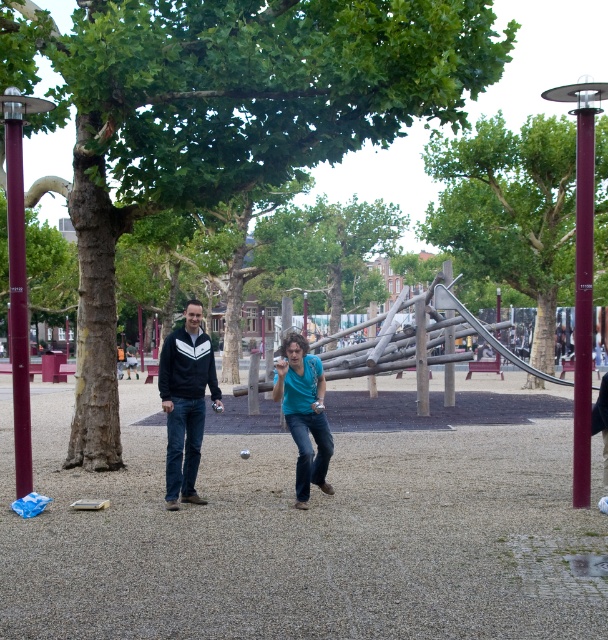
You are a photographer trying to capture a candid shot of the two people in the park. You notice the dark blue jacket at center and the blue denim jeans at center. Which clothing item is covering the other?

The dark blue jacket at center is positioned over the blue denim jeans at center, so the jacket is covering the jeans.

You are a photographer trying to capture a candid shot of the two people in the scene. You notice that the blue denim jeans at center and the matte black jacket at center are close to each other. Which of these two items would appear narrower in your photo?

The blue denim jeans at center is thinner than the matte black jacket at center, so it would appear narrower in the photo.